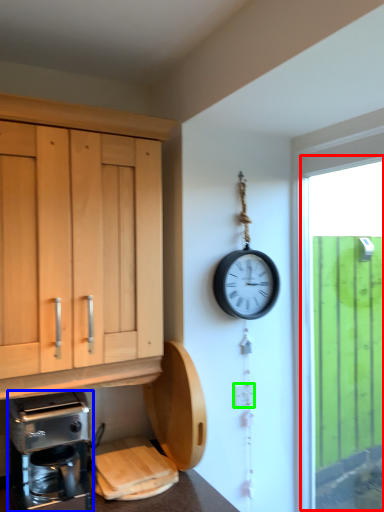
Question: Based on their relative distances, which object is farther from window (highlighted by a red box)? Choose from coffee maker (highlighted by a blue box) and electric outlet (highlighted by a green box).

Choices:
 (A) coffee maker
 (B) electric outlet

Answer: (A)